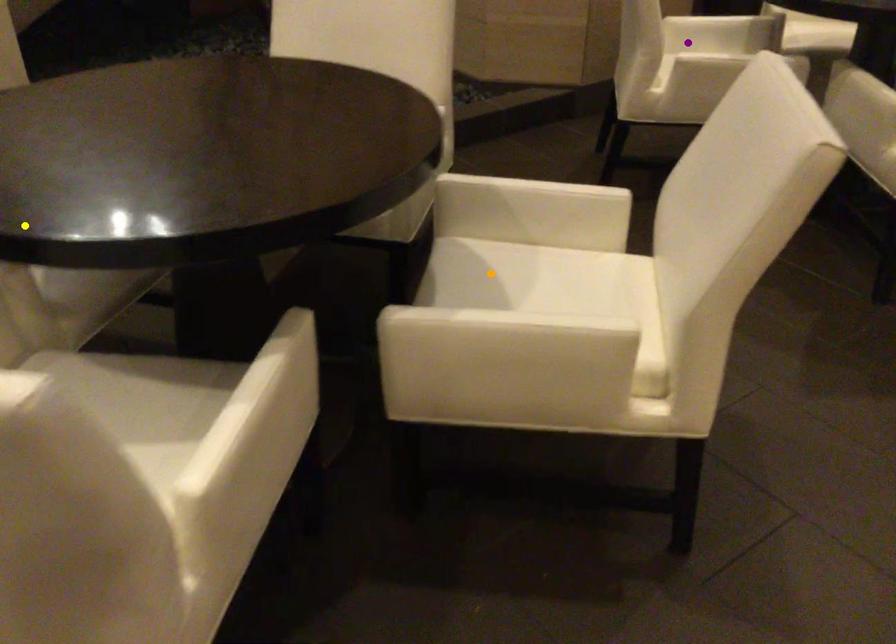
In the scene shown: Order these from nearest to farthest:
purple point, yellow point, orange point

purple point < orange point < yellow point